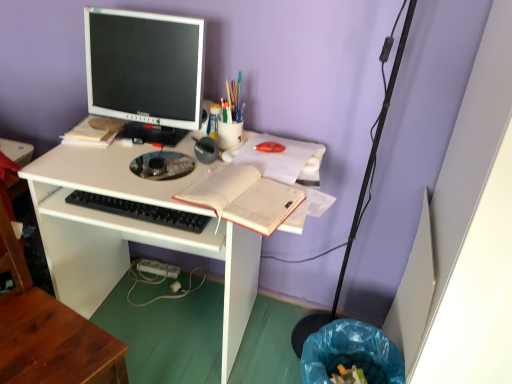
I want to click on vacant space behind white plastic power plugs and sockets at lower center, so click(176, 277).